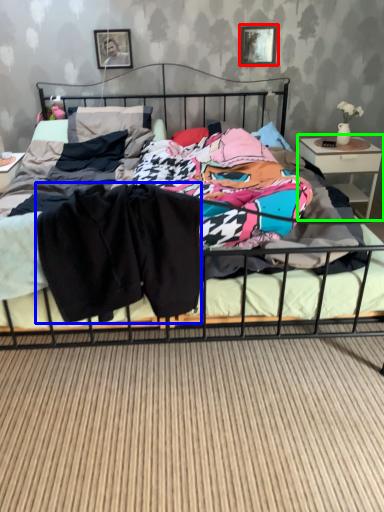
Question: Considering the real-world distances, which object is closest to picture frame (highlighted by a red box)? clothing (highlighted by a blue box) or nightstand (highlighted by a green box).

Choices:
 (A) clothing
 (B) nightstand

Answer: (B)